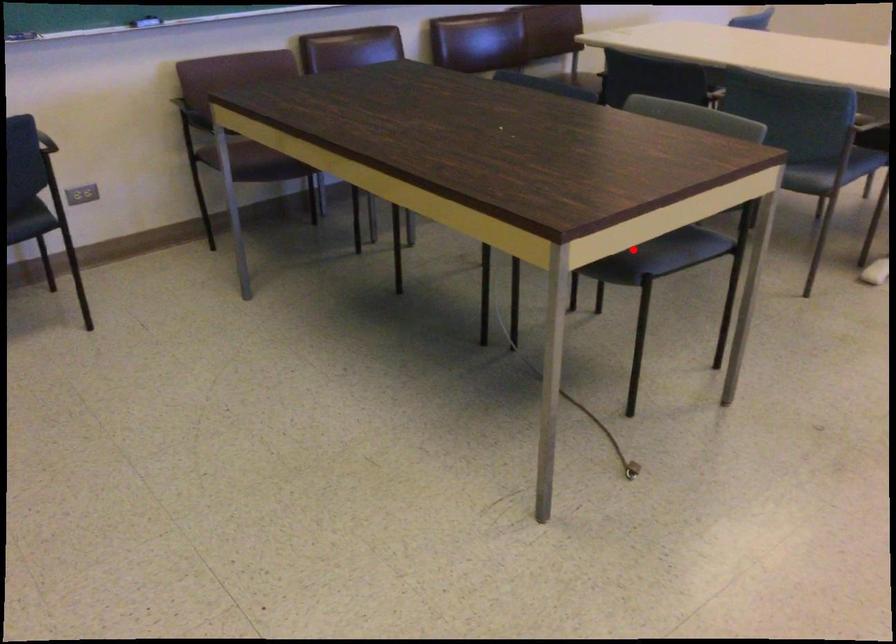
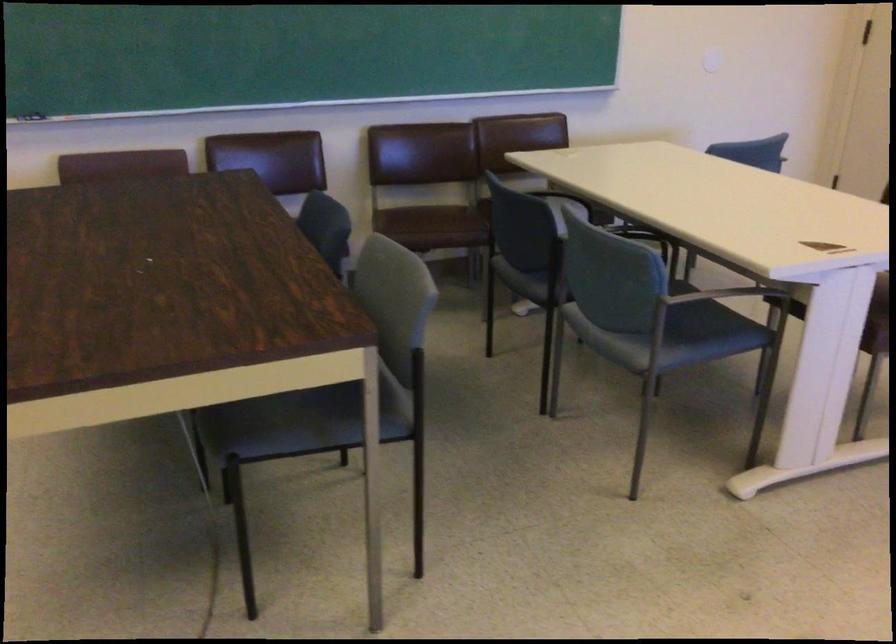
Question: I am providing you with two images of the same scene from different viewpoints. In image1, a red point is highlighted. Considering the same 3D point in image2, which of the following is correct?

Choices:
 (A) It is closer
 (B) It is farther

Answer: (A)